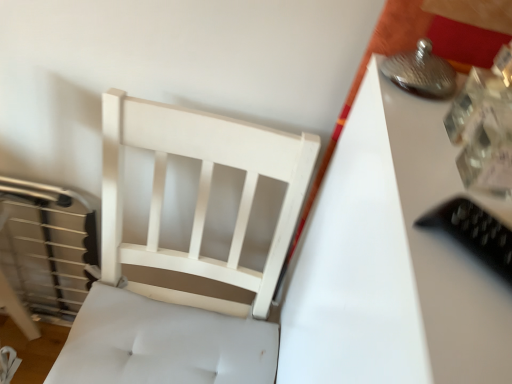
Question: In terms of size, does white wood chair at left appear bigger or smaller than white glossy table at upper right?

Choices:
 (A) small
 (B) big

Answer: (A)

Question: Considering the positions of white wood chair at left and white glossy table at upper right in the image, is white wood chair at left taller or shorter than white glossy table at upper right?

Choices:
 (A) short
 (B) tall

Answer: (A)

Question: Which object is positioned closest to the white glossy table at upper right?

Choices:
 (A) black plastic remote at right
 (B) white wood chair at left

Answer: (A)

Question: Estimate the real-world distances between objects in this image. Which object is closer to the white glossy table at upper right?

Choices:
 (A) white wood chair at left
 (B) black plastic remote at right

Answer: (B)